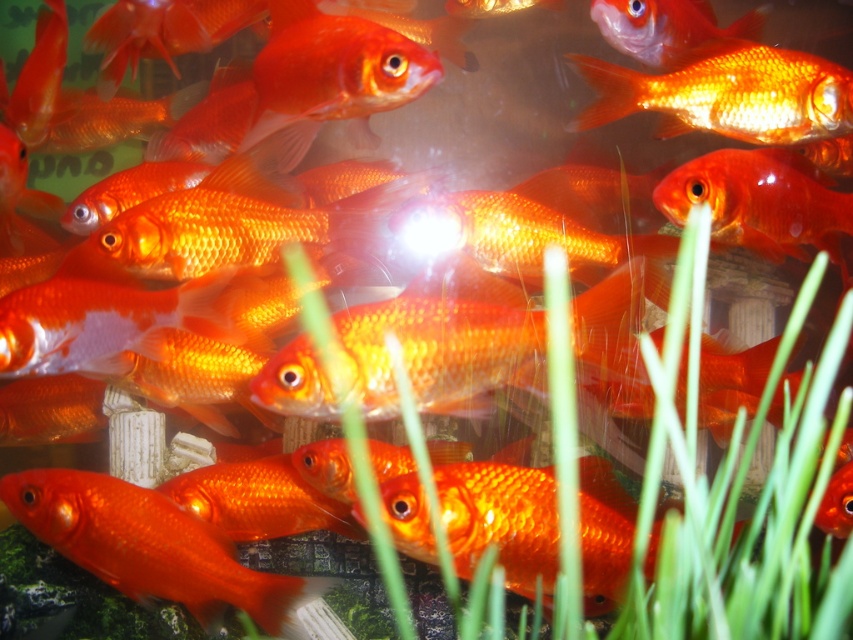
Who is shorter, shiny orange goldfish at center or shiny orange goldfish at upper right?

shiny orange goldfish at upper right

Which is in front, point (108, 520) or point (733, 106)?

Point (108, 520)

This screenshot has height=640, width=853. What are the coordinates of `shiny orange goldfish at center` in the screenshot? It's located at (152, 547).